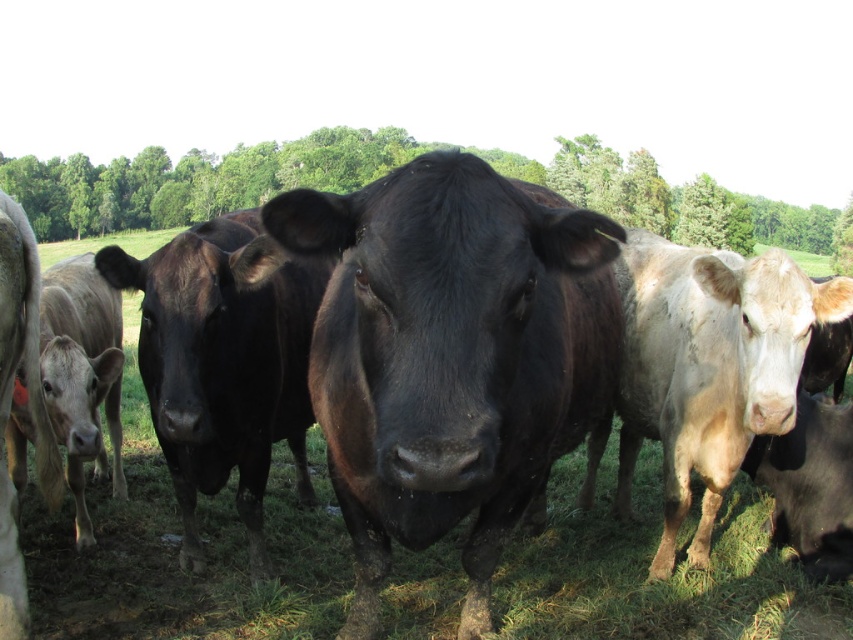
Does point (115, 484) come farther from viewer compared to point (784, 449)?

Yes, it is.

Does light brown smooth calf at left have a greater height compared to black glossy cow at lower right?

Yes, light brown smooth calf at left is taller than black glossy cow at lower right.

Between point (55, 323) and point (822, 477), which one is positioned behind?

The point (822, 477) is more distant.

The width and height of the screenshot is (853, 640). Find the location of `light brown smooth calf at left`. light brown smooth calf at left is located at coordinates (82, 376).

Does shiny black bull at center have a greater width compared to black glossy cow at lower right?

Yes, shiny black bull at center is wider than black glossy cow at lower right.

Does point (300, 422) lie in front of point (815, 452)?

Yes, it is in front of point (815, 452).

Identify the location of shiny black bull at center. (x=224, y=362).

Between black glossy bull at center and shiny black cow at left, which one has more height?

Standing taller between the two is black glossy bull at center.

Is black glossy bull at center shorter than shiny black cow at left?

No.

This screenshot has width=853, height=640. In order to click on black glossy bull at center in this screenshot , I will do `click(453, 356)`.

Locate an element on the screen. black glossy bull at center is located at coordinates (453, 356).